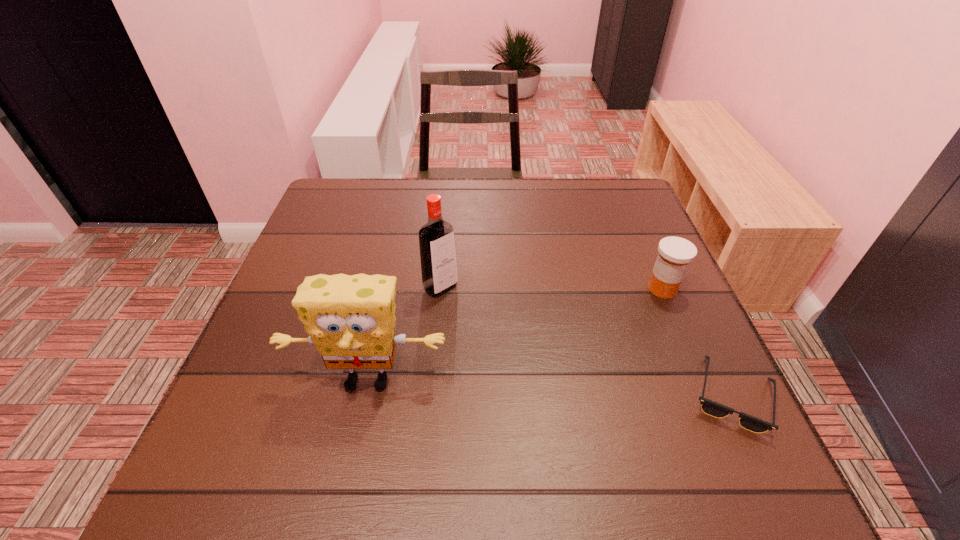
Identify the location of free space at the far left corner of the desktop. The image size is (960, 540). (328, 211).

Find the location of a particular element. The image size is (960, 540). vacant space at the near left corner of the desktop is located at coordinates (232, 391).

Identify the location of free region at the far right corner of the desktop. (617, 207).

In order to click on vacant region at the near right corner in this screenshot , I will do `click(732, 430)`.

Find the location of a particular element. This screenshot has height=540, width=960. vacant area that lies between the sunglasses and the sponge is located at coordinates (550, 388).

Find the location of a particular element. This screenshot has height=540, width=960. vacant space that's between the medicine and the vodka is located at coordinates (552, 288).

Find the location of a particular element. The image size is (960, 540). free spot between the vodka and the sponge is located at coordinates (404, 334).

You are a GUI agent. You are given a task and a screenshot of the screen. Output one action in this format:
    pyautogui.click(x=<x>, y=<y>)
    Task: Click on the free space between the vodka and the sponge
    Image resolution: width=960 pixels, height=540 pixels.
    Given the screenshot: What is the action you would take?
    pyautogui.click(x=404, y=334)

I want to click on vacant region between the shortest object and the medicine, so click(697, 342).

This screenshot has height=540, width=960. Find the location of `empty location between the shortest object and the medicine`. empty location between the shortest object and the medicine is located at coordinates (697, 342).